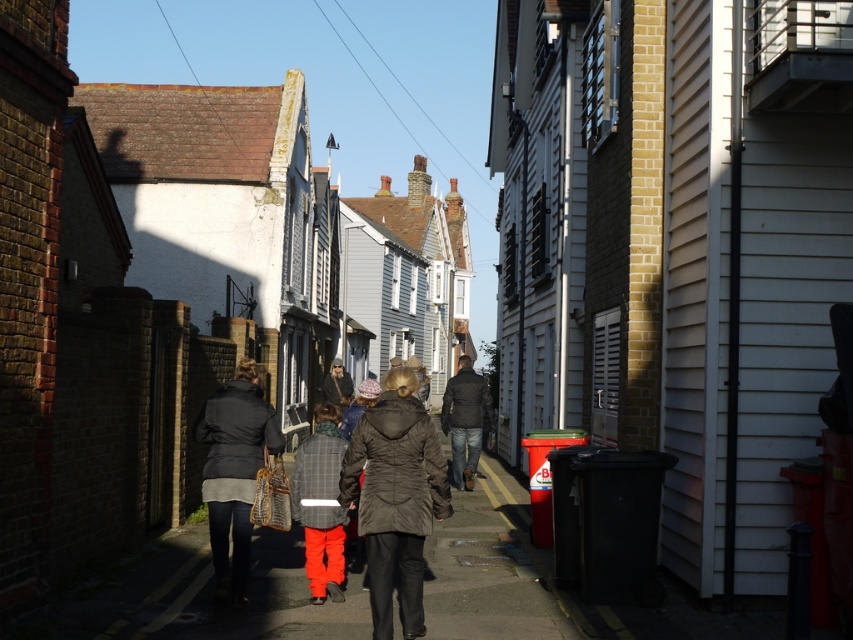
Is the position of dark brown textured coat at center less distant than that of matte black jacket at center?

Yes, dark brown textured coat at center is in front of matte black jacket at center.

Is point (410, 442) positioned after point (271, 410)?

That is False.

Between point (415, 531) and point (248, 380), which one is positioned in front?

Point (415, 531)

Image resolution: width=853 pixels, height=640 pixels. I want to click on dark brown textured coat at center, so click(395, 497).